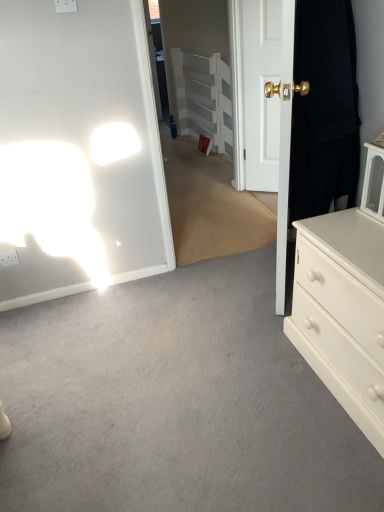
Find the location of a particular element. Image resolution: width=384 pixels, height=512 pixels. free region on the left part of white glossy door at center, arranged as the first door when viewed from the back is located at coordinates (239, 195).